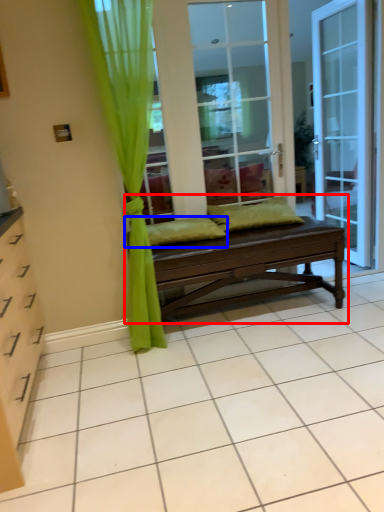
Question: Which of the following is the closest to the observer, studio couch (highlighted by a red box) or pillow (highlighted by a blue box)?

Choices:
 (A) studio couch
 (B) pillow

Answer: (A)